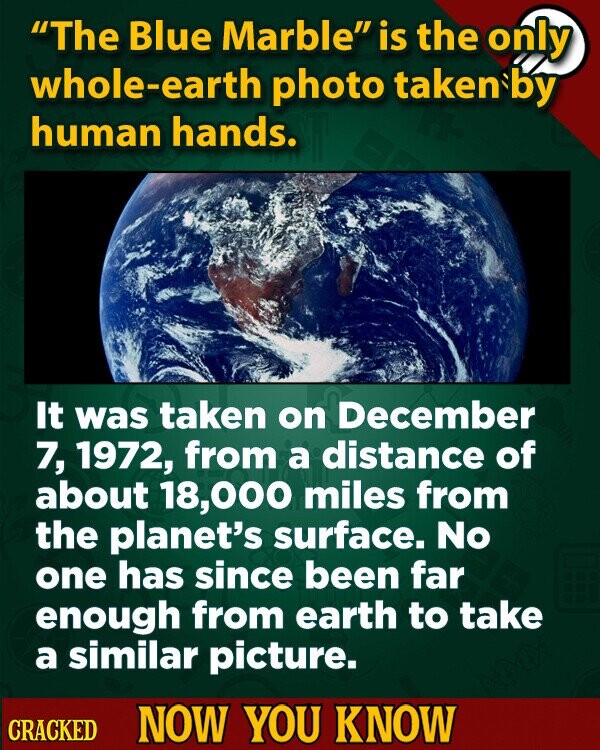
Locate an element on the screen. This screenshot has width=600, height=750. used to light a room is located at coordinates (561, 64).